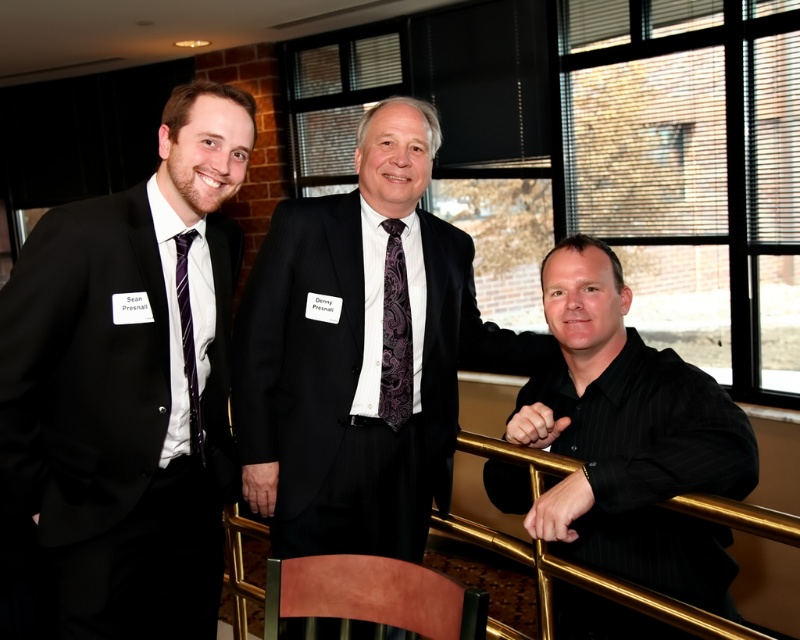
Question: Can you confirm if matte black suit at left is positioned above purple striped tie at left?

Choices:
 (A) yes
 (B) no

Answer: (B)

Question: Estimate the real-world distances between objects in this image. Which object is farther from the black pinstripe shirt at right?

Choices:
 (A) matte black suit at center
 (B) purple striped tie at left
 (C) matte black suit at left

Answer: (B)

Question: Considering the relative positions of matte black suit at center and purple striped tie at left in the image provided, where is matte black suit at center located with respect to purple striped tie at left?

Choices:
 (A) left
 (B) right

Answer: (B)

Question: Estimate the real-world distances between objects in this image. Which object is farther from the black pinstripe shirt at right?

Choices:
 (A) matte black suit at left
 (B) purple striped tie at left
 (C) purple paisley tie at center

Answer: (B)

Question: Among these points, which one is farthest from the camera?

Choices:
 (A) (502, 336)
 (B) (190, 376)

Answer: (A)

Question: Is matte black suit at center positioned at the back of purple striped tie at left?

Choices:
 (A) no
 (B) yes

Answer: (B)